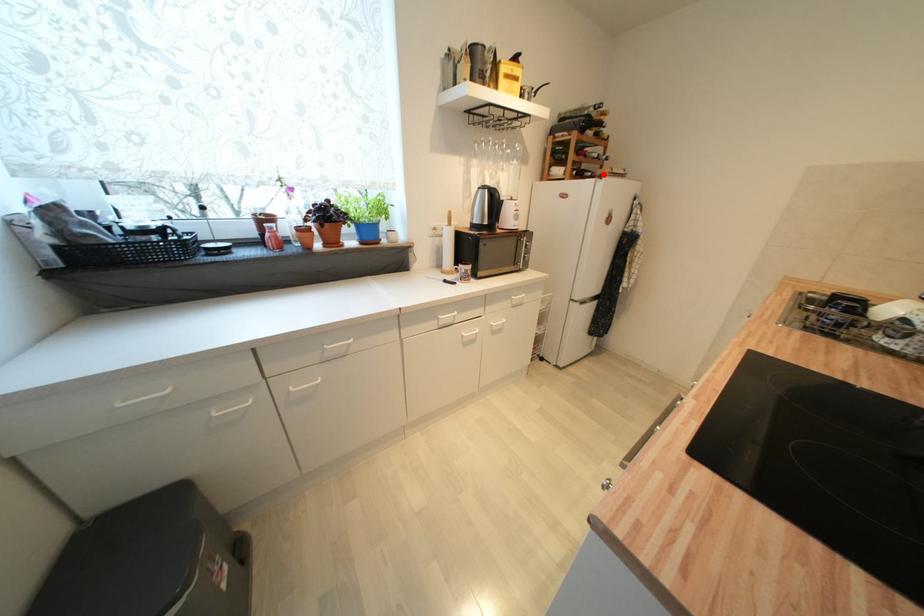
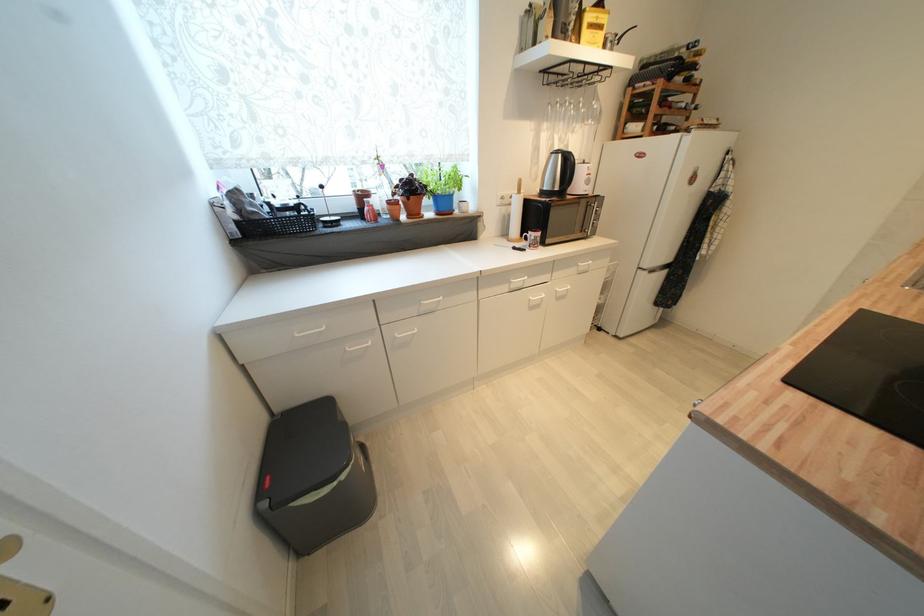
Find the pixel in the second image that matches the highlighted location in the first image.

(690, 127)